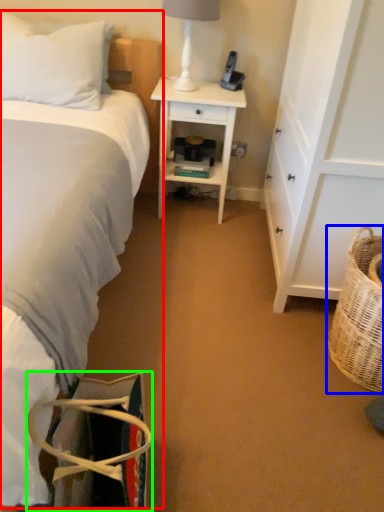
Question: Estimate the real-world distances between objects in this image. Which object is farther from bed (highlighted by a red box), picnic basket (highlighted by a blue box) or handbag (highlighted by a green box)?

Choices:
 (A) picnic basket
 (B) handbag

Answer: (A)